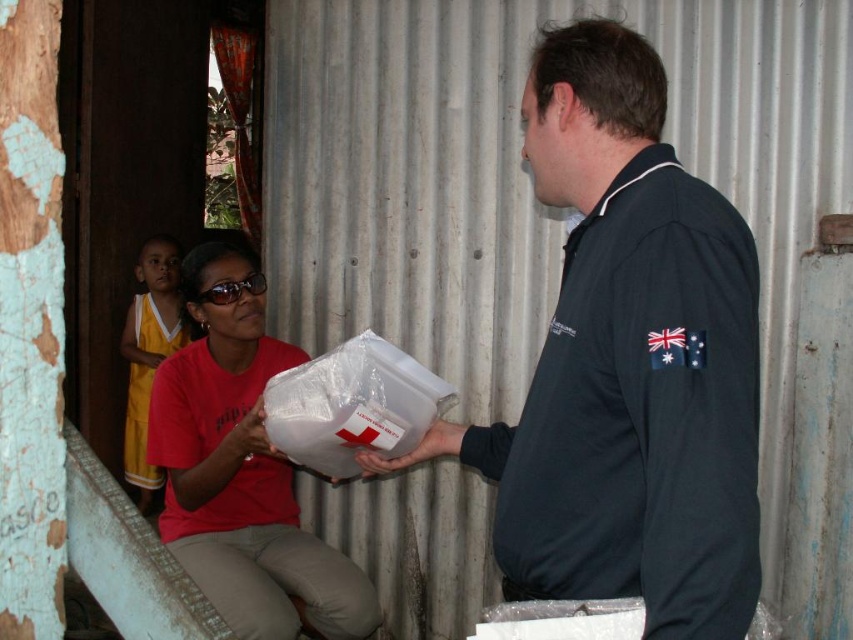
Based on the scene description, where exactly is the dark blue polo shirt at center located in terms of coordinates?

The dark blue polo shirt at center is located at point coordinates of (627, 364).

You are organizing a sports event and need to ensure proper uniform sizes. You have two uniforms available, the dark blue polo shirt at center and the yellow jersey at left. Which uniform has a larger size?

The yellow jersey at left is larger than the dark blue polo shirt at center.